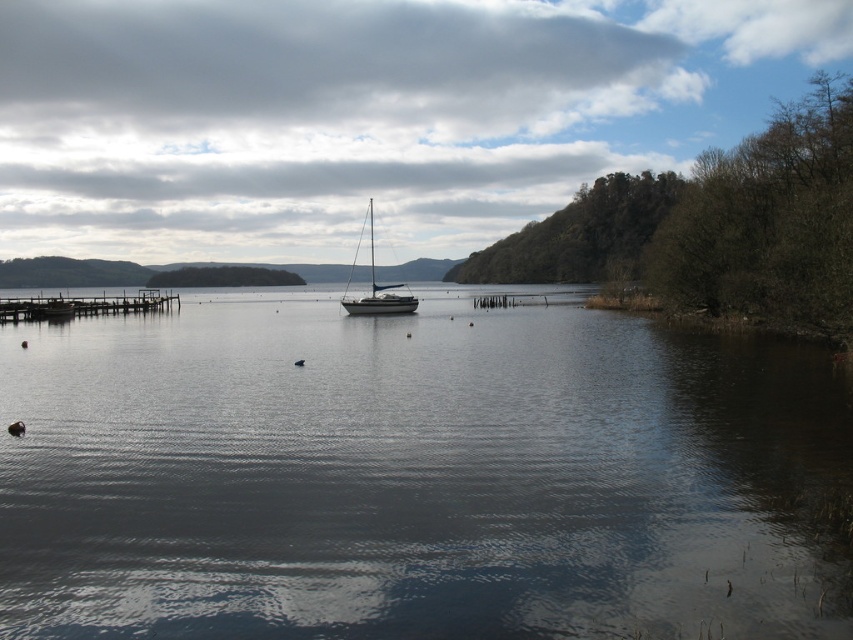
You are standing at the point marked as point (409, 474) in the image, which is the location of the dark reflective water at center. If you look towards the direction of the small sailboat anchored in the middle of the lake slightly to the left side of the frame, what would you see?

You would see the small sailboat anchored in the middle of the lake slightly to the left side of the frame, as the point (409, 474) marks the location of the dark reflective water at center, which is positioned between you and the sailboat in the lake.